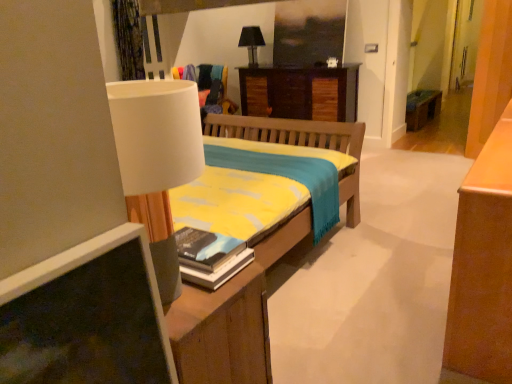
At what (x,y) coordinates should I click in order to perform the action: click on vacant area that is in front of hardcover book at center. Please return your answer as a coordinate pair (x, y). Looking at the image, I should click on (197, 299).